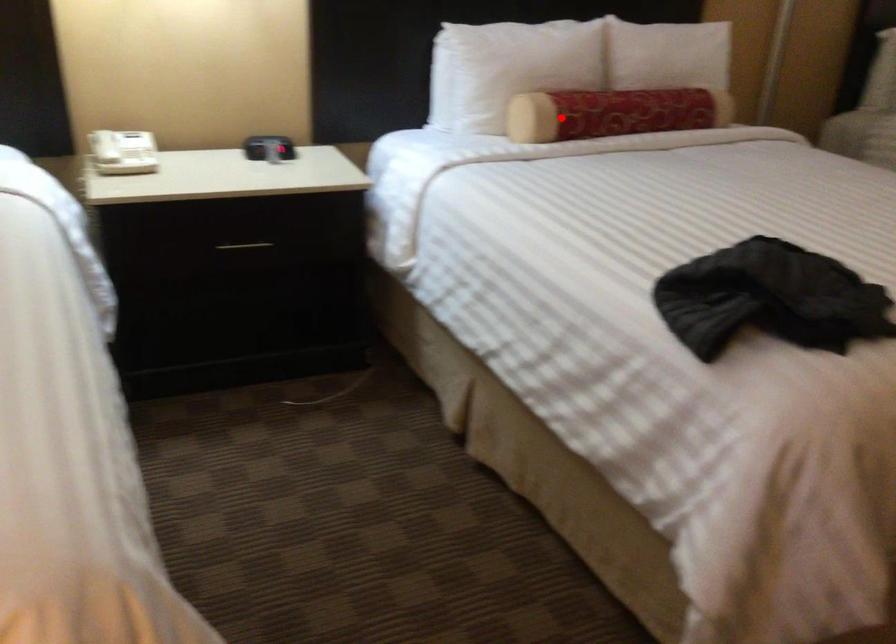
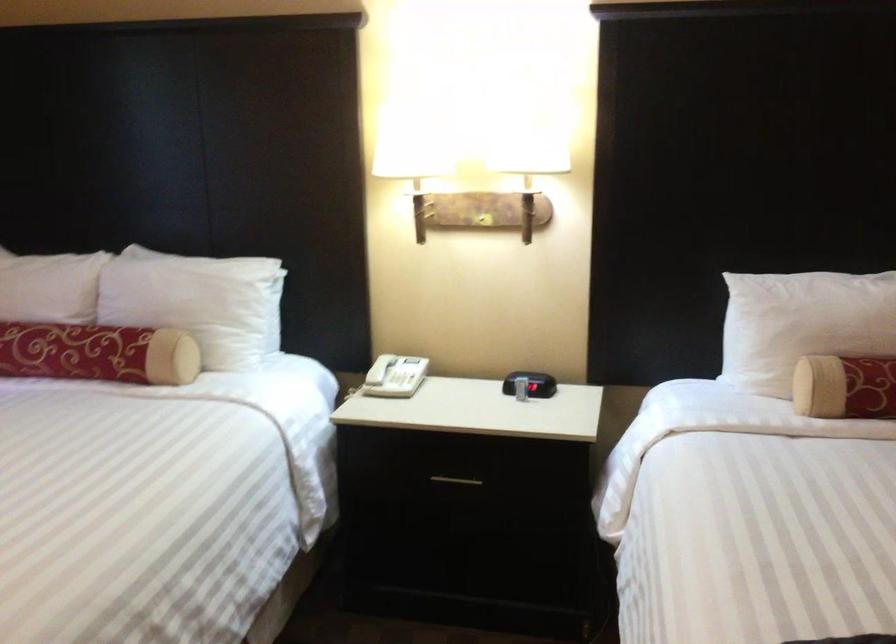
Question: A red point is marked in image1. In image2, is the corresponding 3D point closer to the camera or farther? Reply with the corresponding letter.

Choices:
 (A) The corresponding 3D point is closer.
 (B) The corresponding 3D point is farther.

Answer: (A)